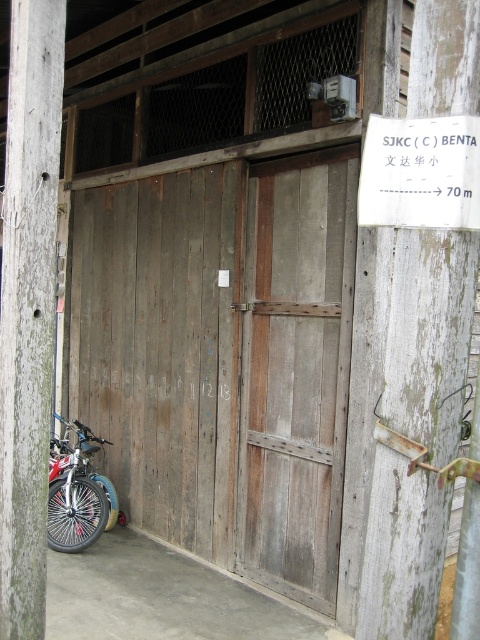
Question: Which object is positioned closest to the weathered wood sign at right?

Choices:
 (A) shiny metallic bicycle at lower left
 (B) weathered wood garage door at center
 (C) white paper sign at upper right
 (D) weathered wood post at left

Answer: (C)

Question: Is weathered wood garage door at center to the left of weathered wood sign at right from the viewer's perspective?

Choices:
 (A) yes
 (B) no

Answer: (A)

Question: Which point is farther to the camera?

Choices:
 (A) (266, 168)
 (B) (108, 486)
 (C) (361, 276)
 (D) (14, 580)

Answer: (B)

Question: Which object is the closest to the white paper sign at upper right?

Choices:
 (A) weathered wood door at center
 (B) weathered wood post at left

Answer: (B)

Question: Is weathered wood sign at right positioned at the back of white paper sign at upper right?

Choices:
 (A) no
 (B) yes

Answer: (B)

Question: Is weathered wood door at center wider than shiny metallic bicycle at lower left?

Choices:
 (A) yes
 (B) no

Answer: (A)